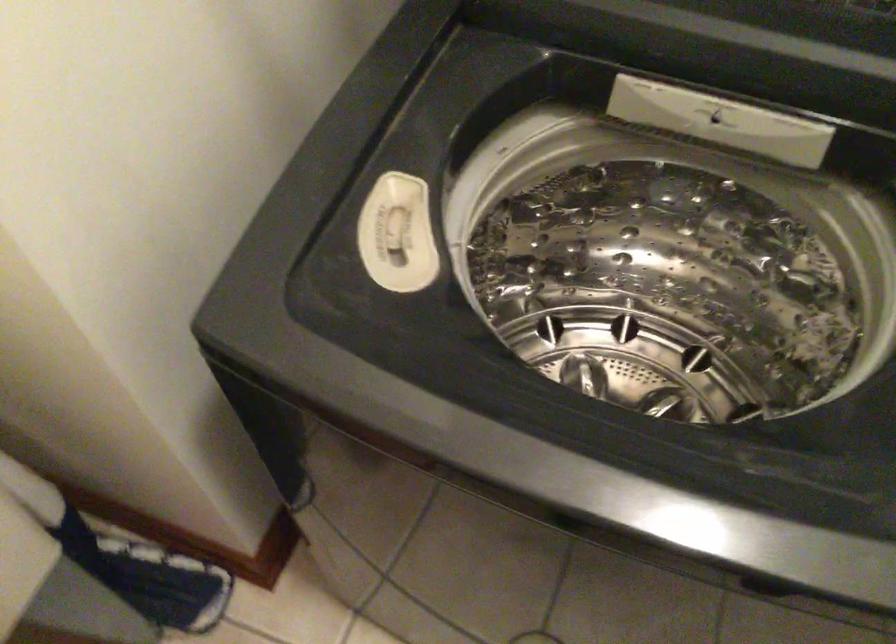
Where would you turn the dispenser switch? Please return your answer as a coordinate pair (x, y).

(719, 120)